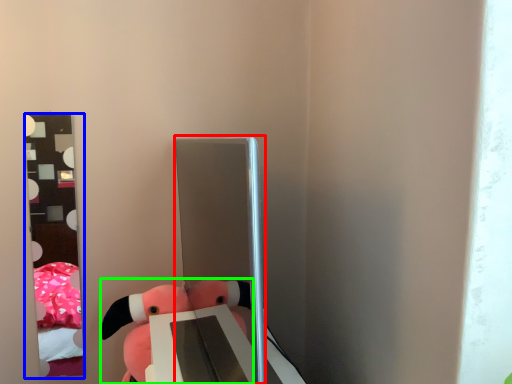
Question: Which object is the farthest from glass door (highlighted by a red box)? Choose among these: mirror (highlighted by a blue box) or toy (highlighted by a green box).

Choices:
 (A) mirror
 (B) toy

Answer: (A)